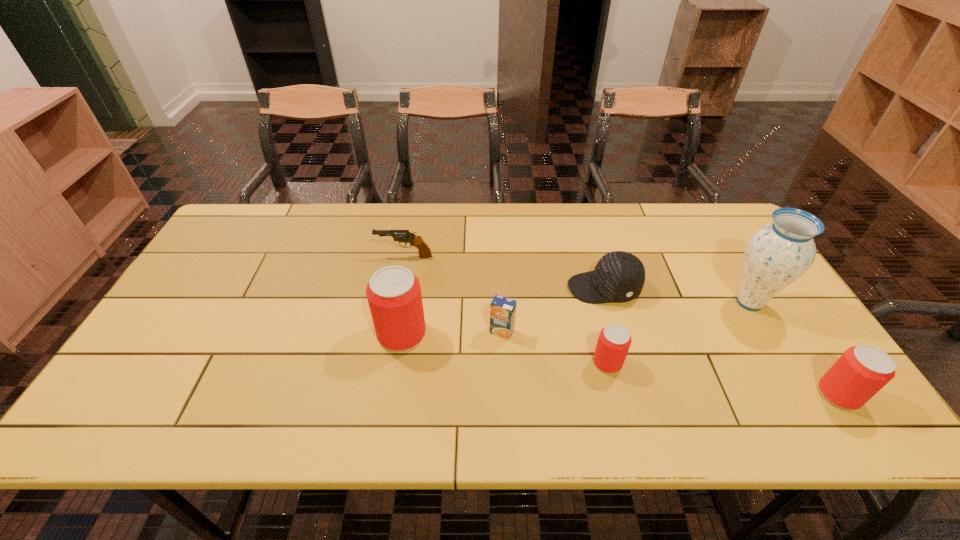
The width and height of the screenshot is (960, 540). In order to click on free space for a new beer can on the left in this screenshot , I will do `click(218, 309)`.